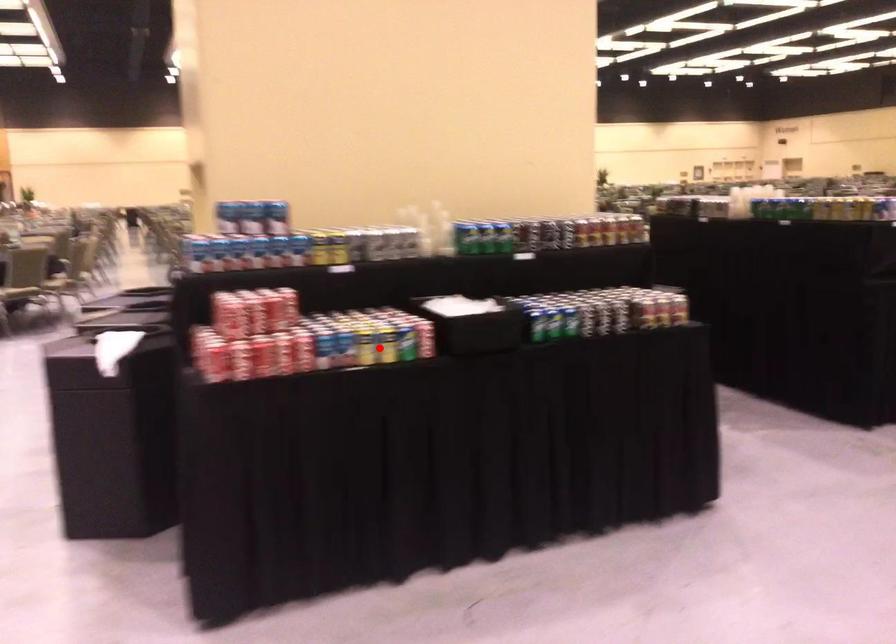
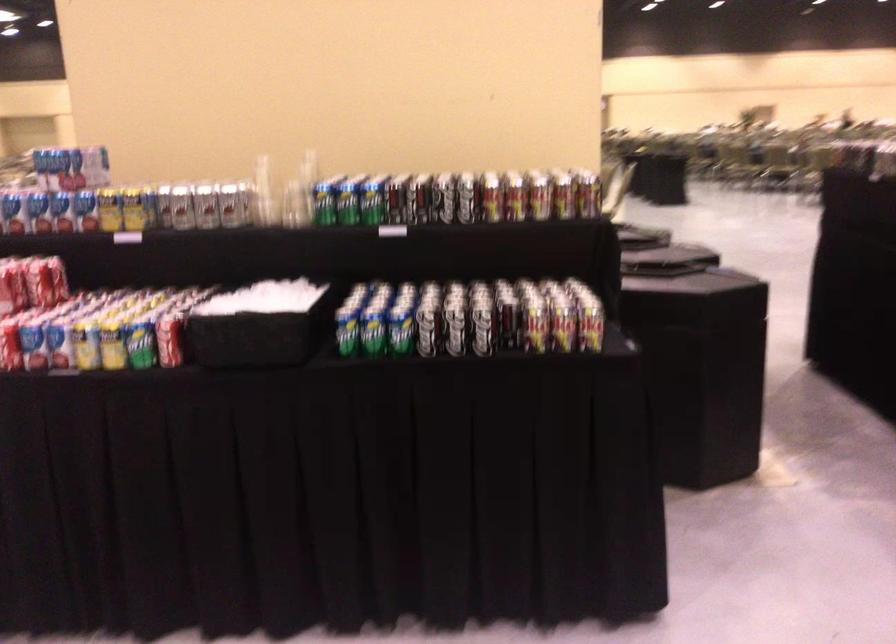
Question: A red point is marked in image1. In image2, is the corresponding 3D point closer to the camera or farther? Reply with the corresponding letter.

Choices:
 (A) The corresponding 3D point is closer.
 (B) The corresponding 3D point is farther.

Answer: (A)